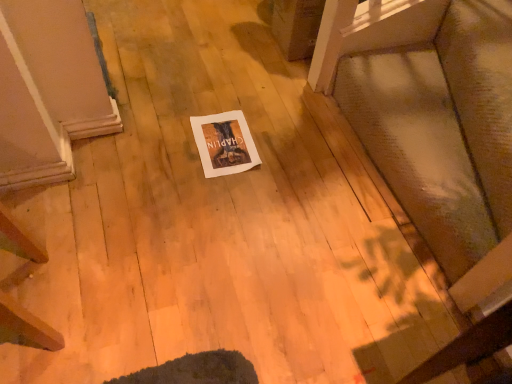
Locate an element on the screen. The height and width of the screenshot is (384, 512). free space in front of white paper at center is located at coordinates (216, 193).